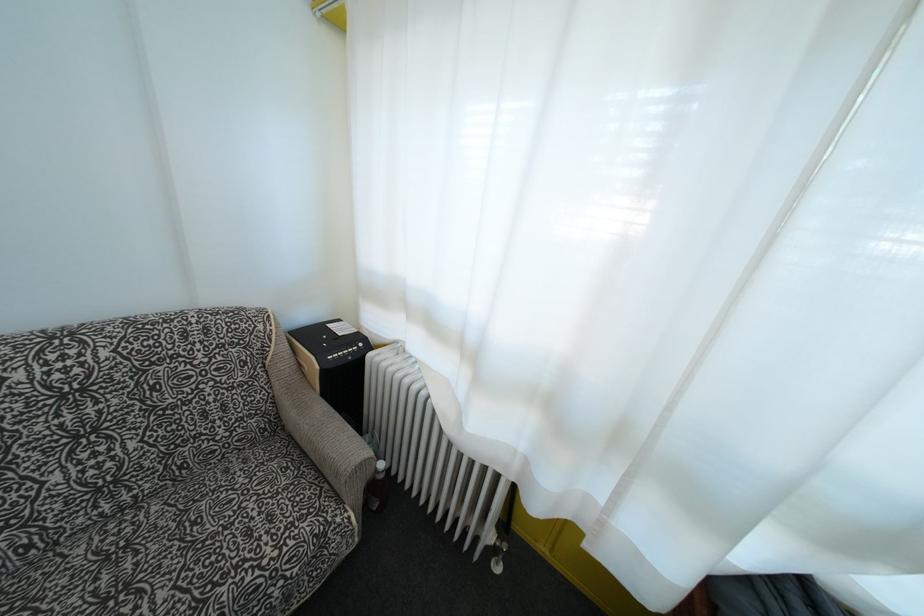
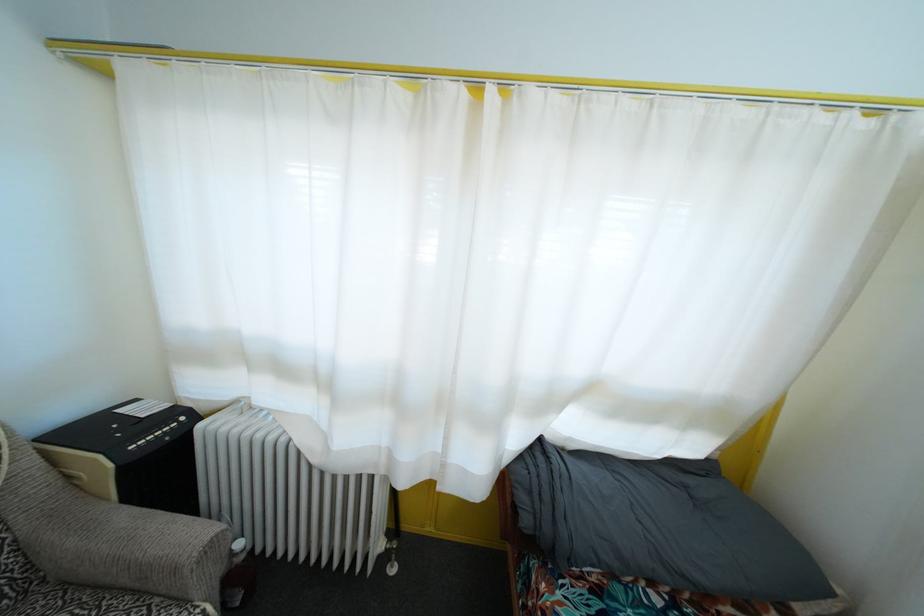
In the second image, find the point that corresponds to point 330,493 in the first image.

(161, 608)